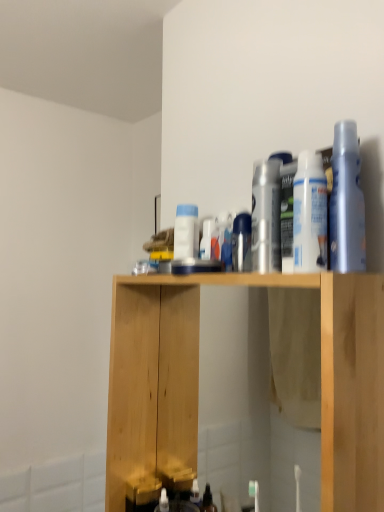
Image resolution: width=384 pixels, height=512 pixels. Describe the element at coordinates (241, 242) in the screenshot. I see `satin silver spray can at center` at that location.

Locate an element on the screen. natural wood cabinet at center is located at coordinates (198, 380).

You are a GUI agent. You are given a task and a screenshot of the screen. Output one action in this format:
    pyautogui.click(x=<x>, y=<y>)
    Task: Click on the white glossy spray can at center, which appears as the fourth cleaning product when viewed from the right
    The image size is (384, 512).
    Given the screenshot: What is the action you would take?
    pyautogui.click(x=186, y=232)

Find the location of `white matte spray can at upper right, which ranks as the 2th cleaning product in right-to-left order`. white matte spray can at upper right, which ranks as the 2th cleaning product in right-to-left order is located at coordinates (310, 214).

Find the location of a particular element. Image resolution: width=384 pixels, height=512 pixels. translucent plastic spray bottle at upper right, which is the 1th cleaning product from right to left is located at coordinates (346, 203).

Is point (133, 376) positioned after point (240, 263)?

That is True.

Is natural wood cabinet at center thinner than satin silver spray can at center?

No.

Can you tell me how much natural wood cabinet at center and satin silver spray can at center differ in facing direction?

The angular difference between natural wood cabinet at center and satin silver spray can at center is 0.314 degrees.

How distant is natural wood cabinet at center from satin silver spray can at center?

The distance of natural wood cabinet at center from satin silver spray can at center is 12.93 inches.

Is white glossy spray can at center, acting as the first cleaning product starting from the back, oriented away from translucent plastic spray bottle at upper right, marked as the 4th cleaning product in a back-to-front arrangement?

No, white glossy spray can at center, acting as the first cleaning product starting from the back, is not facing the opposite direction of translucent plastic spray bottle at upper right, marked as the 4th cleaning product in a back-to-front arrangement.

Is white glossy spray can at center, acting as the first cleaning product starting from the back, bigger than translucent plastic spray bottle at upper right, marked as the first cleaning product in a front-to-back arrangement?

Incorrect, white glossy spray can at center, acting as the first cleaning product starting from the back, is not larger than translucent plastic spray bottle at upper right, marked as the first cleaning product in a front-to-back arrangement.

Which of these two, white glossy spray can at center, acting as the first cleaning product starting from the back, or translucent plastic spray bottle at upper right, which is the 1th cleaning product from right to left, stands taller?

Standing taller between the two is translucent plastic spray bottle at upper right, which is the 1th cleaning product from right to left.

Who is bigger, satin silver spray can at center or silver metallic can at center, the third cleaning product viewed from the front?

silver metallic can at center, the third cleaning product viewed from the front, is bigger.

Image resolution: width=384 pixels, height=512 pixels. There is a satin silver spray can at center. Identify the location of the 2nd cleaning product above it (from the image's perspective). (266, 217).

Is satin silver spray can at center next to silver metallic can at center, which is the 2th cleaning product from left to right, and touching it?

Yes, satin silver spray can at center is next to silver metallic can at center, which is the 2th cleaning product from left to right.

Which object is more forward, satin silver spray can at center or silver metallic can at center, which is the 2th cleaning product from left to right?

silver metallic can at center, which is the 2th cleaning product from left to right, is in front.

Considering the relative positions of satin silver spray can at center and white glossy spray can at center, which is counted as the first cleaning product, starting from the left, in the image provided, is satin silver spray can at center to the right of white glossy spray can at center, which is counted as the first cleaning product, starting from the left, from the viewer's perspective?

Correct, you'll find satin silver spray can at center to the right of white glossy spray can at center, which is counted as the first cleaning product, starting from the left.

Is point (237, 266) positioned in front of point (183, 255)?

Yes, point (237, 266) is in front of point (183, 255).

Could you tell me if satin silver spray can at center is turned towards white glossy spray can at center, which appears as the fourth cleaning product when viewed from the right?

No, satin silver spray can at center is not aimed at white glossy spray can at center, which appears as the fourth cleaning product when viewed from the right.

Between satin silver spray can at center and natural wood cabinet at center, which one appears on the left side from the viewer's perspective?

Positioned to the left is natural wood cabinet at center.

Is satin silver spray can at center aimed at natural wood cabinet at center?

No, satin silver spray can at center is not facing towards natural wood cabinet at center.

Is satin silver spray can at center located outside natural wood cabinet at center?

Absolutely, satin silver spray can at center is external to natural wood cabinet at center.

Can you tell me how much satin silver spray can at center and natural wood cabinet at center differ in facing direction?

There is a 0.314-degree angle between the facing directions of satin silver spray can at center and natural wood cabinet at center.

Looking at the image, does white glossy spray can at center, acting as the first cleaning product starting from the back, seem bigger or smaller compared to satin silver spray can at center?

Considering their sizes, white glossy spray can at center, acting as the first cleaning product starting from the back, takes up more space than satin silver spray can at center.

From the image's perspective, is white glossy spray can at center, which is counted as the first cleaning product, starting from the left, above or below satin silver spray can at center?

From the image's perspective, white glossy spray can at center, which is counted as the first cleaning product, starting from the left, appears above satin silver spray can at center.

Could you tell me if white glossy spray can at center, which appears as the fourth cleaning product when viewed from the right, is turned towards satin silver spray can at center?

No, white glossy spray can at center, which appears as the fourth cleaning product when viewed from the right, is not aimed at satin silver spray can at center.

Considering the sizes of objects translucent plastic spray bottle at upper right, which is the 1th cleaning product from right to left, and silver metallic can at center, arranged as the 2th cleaning product when viewed from the back, in the image provided, who is taller, translucent plastic spray bottle at upper right, which is the 1th cleaning product from right to left, or silver metallic can at center, arranged as the 2th cleaning product when viewed from the back,?

With more height is translucent plastic spray bottle at upper right, which is the 1th cleaning product from right to left.

In the scene shown: Based on their positions, is translucent plastic spray bottle at upper right, marked as the first cleaning product in a front-to-back arrangement, located to the left or right of silver metallic can at center, the third cleaning product viewed from the front?

translucent plastic spray bottle at upper right, marked as the first cleaning product in a front-to-back arrangement, is to the right of silver metallic can at center, the third cleaning product viewed from the front.

Measure the distance between translucent plastic spray bottle at upper right, the fourth cleaning product from the left, and silver metallic can at center, which is the 2th cleaning product from left to right.

translucent plastic spray bottle at upper right, the fourth cleaning product from the left, is 11.93 centimeters away from silver metallic can at center, which is the 2th cleaning product from left to right.

From a real-world perspective, who is located lower, translucent plastic spray bottle at upper right, marked as the first cleaning product in a front-to-back arrangement, or silver metallic can at center, arranged as the 2th cleaning product when viewed from the back?

silver metallic can at center, arranged as the 2th cleaning product when viewed from the back, from a real-world perspective.

I want to click on cabinetry below the satin silver spray can at center (from the image's perspective), so click(198, 380).

Find the location of a particular element. This screenshot has width=384, height=512. the 3rd cleaning product positioned above the white glossy spray can at center, the 4th cleaning product when ordered from front to back (from a real-world perspective) is located at coordinates (346, 203).

From the image, which object appears to be farther from natural wood cabinet at center, white glossy spray can at center, which appears as the fourth cleaning product when viewed from the right, or satin silver spray can at center?

satin silver spray can at center lies further to natural wood cabinet at center than the other object.

Estimate the real-world distances between objects in this image. Which object is further from satin silver spray can at center, translucent plastic spray bottle at upper right, which is the 1th cleaning product from right to left, or silver metallic can at center, arranged as the 2th cleaning product when viewed from the back?

The object further to satin silver spray can at center is translucent plastic spray bottle at upper right, which is the 1th cleaning product from right to left.

When comparing their distances from translucent plastic spray bottle at upper right, the fourth cleaning product from the left, does silver metallic can at center, which appears as the 3th cleaning product when viewed from the right, or white glossy spray can at center, the 4th cleaning product when ordered from front to back, seem closer?

Among the two, silver metallic can at center, which appears as the 3th cleaning product when viewed from the right, is located nearer to translucent plastic spray bottle at upper right, the fourth cleaning product from the left.

Looking at the image, which one is located closer to satin silver spray can at center, white matte spray can at upper right, which ranks as the third cleaning product in left-to-right order, or natural wood cabinet at center?

Among the two, white matte spray can at upper right, which ranks as the third cleaning product in left-to-right order, is located nearer to satin silver spray can at center.

Considering their positions, is natural wood cabinet at center positioned further to white glossy spray can at center, the 4th cleaning product when ordered from front to back, than silver metallic can at center, arranged as the 2th cleaning product when viewed from the back?

Based on the image, natural wood cabinet at center appears to be further to white glossy spray can at center, the 4th cleaning product when ordered from front to back.

From the image, which object appears to be nearer to translucent plastic spray bottle at upper right, the fourth cleaning product from the left, satin silver spray can at center or natural wood cabinet at center?

Among the two, satin silver spray can at center is located nearer to translucent plastic spray bottle at upper right, the fourth cleaning product from the left.

Based on their spatial positions, is satin silver spray can at center or silver metallic can at center, the third cleaning product viewed from the front, closer to white matte spray can at upper right, which ranks as the third cleaning product in back-to-front order?

silver metallic can at center, the third cleaning product viewed from the front, lies closer to white matte spray can at upper right, which ranks as the third cleaning product in back-to-front order, than the other object.

When comparing their distances from natural wood cabinet at center, does translucent plastic spray bottle at upper right, marked as the first cleaning product in a front-to-back arrangement, or white glossy spray can at center, which is counted as the first cleaning product, starting from the left, seem further?

The object further to natural wood cabinet at center is translucent plastic spray bottle at upper right, marked as the first cleaning product in a front-to-back arrangement.

Where is `toiletry between silver metallic can at center, which is the 2th cleaning product from left to right, and natural wood cabinet at center in the up-down direction`? The image size is (384, 512). toiletry between silver metallic can at center, which is the 2th cleaning product from left to right, and natural wood cabinet at center in the up-down direction is located at coordinates (241, 242).

I want to click on toiletry between translucent plastic spray bottle at upper right, marked as the first cleaning product in a front-to-back arrangement, and natural wood cabinet at center vertically, so click(241, 242).

The image size is (384, 512). I want to click on toiletry between white glossy spray can at center, which appears as the fourth cleaning product when viewed from the right, and translucent plastic spray bottle at upper right, the fourth cleaning product from the left, from left to right, so click(241, 242).

I want to click on toiletry between white matte spray can at upper right, which ranks as the third cleaning product in back-to-front order, and white glossy spray can at center, the 4th cleaning product when ordered from front to back, from front to back, so (241, 242).